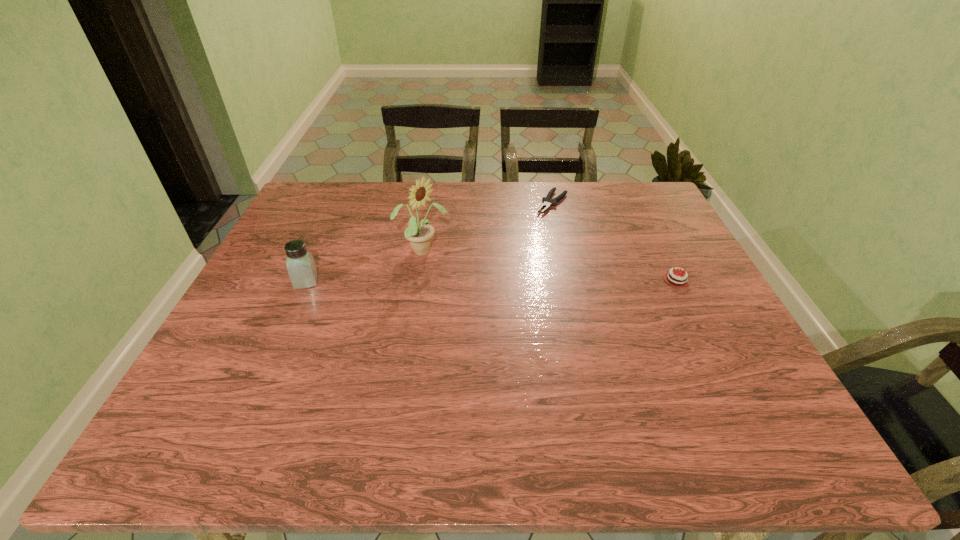
I want to click on the leftmost object, so click(301, 267).

Identify the location of the third shortest object. The image size is (960, 540). (301, 267).

Locate an element on the screen. the second shortest object is located at coordinates (672, 278).

Where is `the rightmost object`? the rightmost object is located at coordinates (672, 278).

Find the location of a particular element. This screenshot has width=960, height=540. the second object from left to right is located at coordinates (419, 234).

I want to click on the tallest object, so click(x=419, y=234).

What are the coordinates of `the second object from right to left` in the screenshot? It's located at (546, 203).

Locate an element on the screen. The width and height of the screenshot is (960, 540). pliers is located at coordinates (546, 203).

At what (x,y) coordinates should I click in order to perform the action: click on vacant area situated 0.140m on the right of the leftmost object. Please return your answer as a coordinate pair (x, y). The image size is (960, 540). Looking at the image, I should click on (372, 281).

This screenshot has height=540, width=960. I want to click on free location located on the left of the chocolate cake, so click(530, 280).